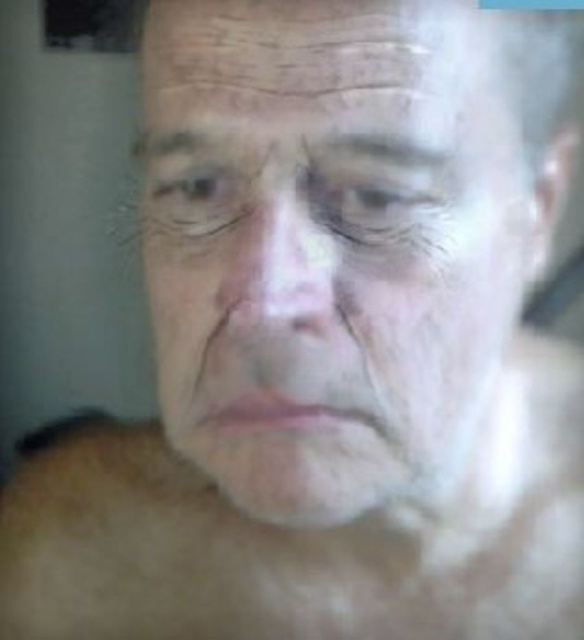
Does flesh-colored skin at center have a lesser height compared to dry skin wrinkle at center?

Incorrect, flesh-colored skin at center's height does not fall short of dry skin wrinkle at center's.

Who is shorter, flesh-colored skin at center or dry skin wrinkle at center?

Standing shorter between the two is dry skin wrinkle at center.

Is point (272, 637) closer to viewer compared to point (230, 314)?

No, (272, 637) is further to viewer.

In order to click on flesh-colored skin at center in this screenshot , I will do `click(307, 538)`.

Is smooth skin face at center bigger than dry skin forehead at upper center?

Yes.

Which of these two, smooth skin face at center or dry skin forehead at upper center, stands taller?

Standing taller between the two is smooth skin face at center.

Which is behind, point (196, 324) or point (335, 106)?

Point (196, 324)

Image resolution: width=584 pixels, height=640 pixels. Find the location of `smooth skin face at center`. smooth skin face at center is located at coordinates (328, 246).

Measure the distance between brown matte eye at upper left and dry skin wrinkle at center.

They are 2.57 inches apart.

Is point (208, 177) in front of point (203, 364)?

That is True.

Locate an element on the screen. Image resolution: width=584 pixels, height=640 pixels. brown matte eye at upper left is located at coordinates (197, 184).

You are a GUI agent. You are given a task and a screenshot of the screen. Output one action in this format:
    pyautogui.click(x=<x>, y=<y>)
    Task: Click on the brown matte eye at upper left
    The image size is (584, 640).
    Given the screenshot: What is the action you would take?
    pyautogui.click(x=197, y=184)